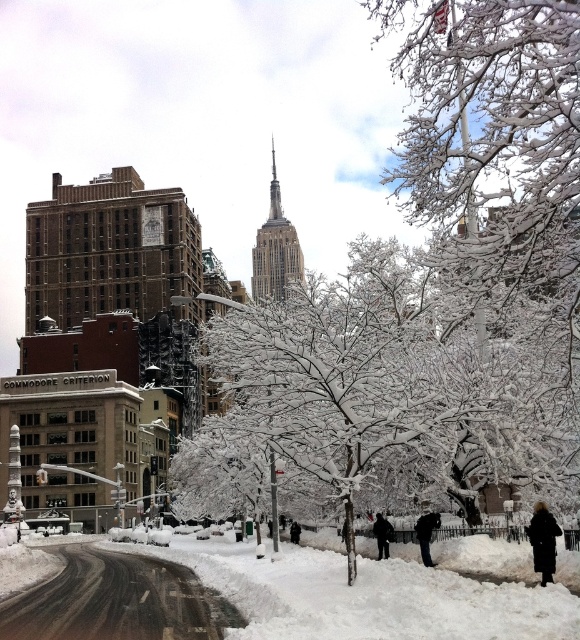
Does black wool coat at lower right appear under black fabric coat at center?

No.

Is black wool coat at lower right to the left of black fabric coat at center from the viewer's perspective?

In fact, black wool coat at lower right is to the right of black fabric coat at center.

Does point (545, 547) lie behind point (425, 540)?

No, (545, 547) is in front of (425, 540).

Identify the location of black wool coat at lower right. This screenshot has width=580, height=640. (543, 541).

Can you confirm if white snow-covered tree at center is positioned to the right of dark gray coat at center?

In fact, white snow-covered tree at center is to the left of dark gray coat at center.

Can you confirm if white snow-covered tree at center is smaller than dark gray coat at center?

Actually, white snow-covered tree at center might be larger than dark gray coat at center.

What do you see at coordinates (364, 396) in the screenshot?
I see `white snow-covered tree at center` at bounding box center [364, 396].

You are a GUI agent. You are given a task and a screenshot of the screen. Output one action in this format:
    pyautogui.click(x=<x>, y=<y>)
    Task: Click on the white snow-covered tree at center
    
    Given the screenshot: What is the action you would take?
    pyautogui.click(x=364, y=396)

Can you confirm if dark gray coat at center is positioned below black wool coat at center?

Incorrect, dark gray coat at center is not positioned below black wool coat at center.

Is dark gray coat at center to the left of black wool coat at center from the viewer's perspective?

No, dark gray coat at center is not to the left of black wool coat at center.

The image size is (580, 640). What do you see at coordinates (382, 534) in the screenshot? I see `dark gray coat at center` at bounding box center [382, 534].

You are a GUI agent. You are given a task and a screenshot of the screen. Output one action in this format:
    pyautogui.click(x=<x>, y=<y>)
    Task: Click on the dark gray coat at center
    The height and width of the screenshot is (640, 580).
    Given the screenshot: What is the action you would take?
    pyautogui.click(x=382, y=534)